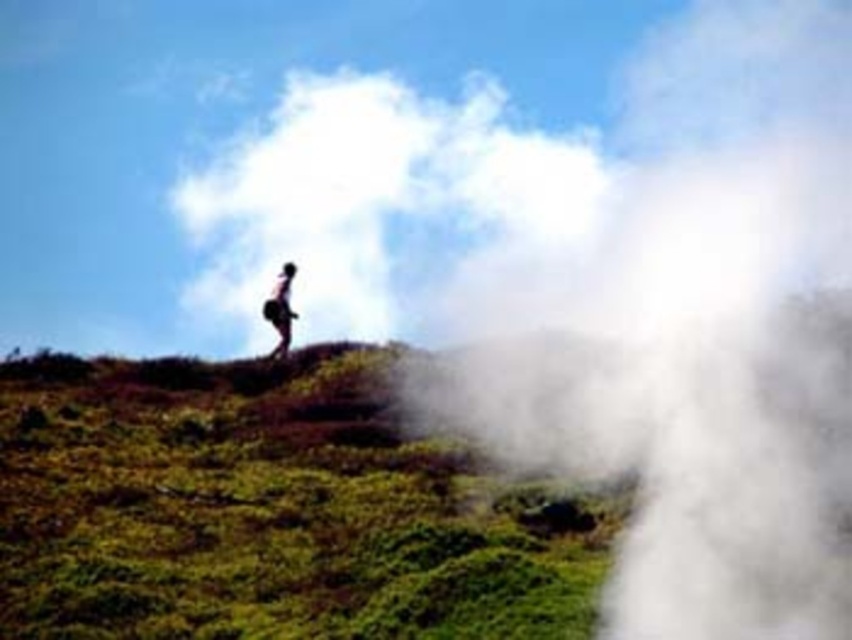
Question: Considering the relative positions of green grassy at center and white fluffy cloud at upper center in the image provided, where is green grassy at center located with respect to white fluffy cloud at upper center?

Choices:
 (A) left
 (B) right

Answer: (B)

Question: Can you confirm if green grassy at center is positioned to the left of white fluffy cloud at upper center?

Choices:
 (A) no
 (B) yes

Answer: (A)

Question: Which point is farther to the camera?

Choices:
 (A) (780, 321)
 (B) (208, 188)
 (C) (358, 490)
 (D) (286, 285)

Answer: (B)

Question: Considering the real-world distances, which object is farthest from the light brown skin at center?

Choices:
 (A) white fluffy cloud at upper center
 (B) white foggy steam at upper right

Answer: (A)

Question: Can you confirm if green grassy at center is positioned to the right of light brown skin at center?

Choices:
 (A) no
 (B) yes

Answer: (B)

Question: Which point is farther to the camera?

Choices:
 (A) light brown skin at center
 (B) white fluffy cloud at upper center
 (C) white foggy steam at upper right
 (D) green grassy at center

Answer: (B)